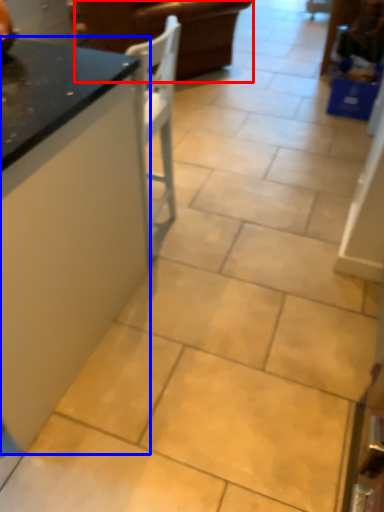
Question: Which object appears closest to the camera in this image, furniture (highlighted by a red box) or countertop (highlighted by a blue box)?

Choices:
 (A) furniture
 (B) countertop

Answer: (B)